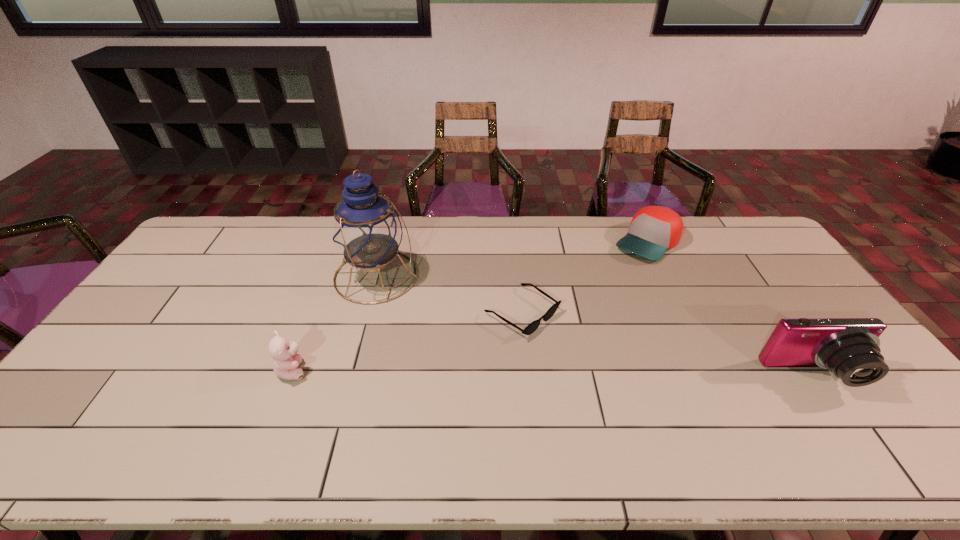
Where is `free space on the desktop that is between the teddy bear and the fourth shortest object and is positioned on the front-facing side of the sunglasses`? This screenshot has width=960, height=540. free space on the desktop that is between the teddy bear and the fourth shortest object and is positioned on the front-facing side of the sunglasses is located at coordinates (614, 374).

Locate an element on the screen. Image resolution: width=960 pixels, height=540 pixels. free spot on the desktop that is between the teddy bear and the camera and is positioned at the brim of the baseball cap is located at coordinates (522, 373).

At what (x,y) coordinates should I click in order to perform the action: click on vacant space on the desktop that is between the teddy bear and the rightmost object and is positioned on the front-facing side of the tallest object. Please return your answer as a coordinate pair (x, y). This screenshot has height=540, width=960. Looking at the image, I should click on (556, 373).